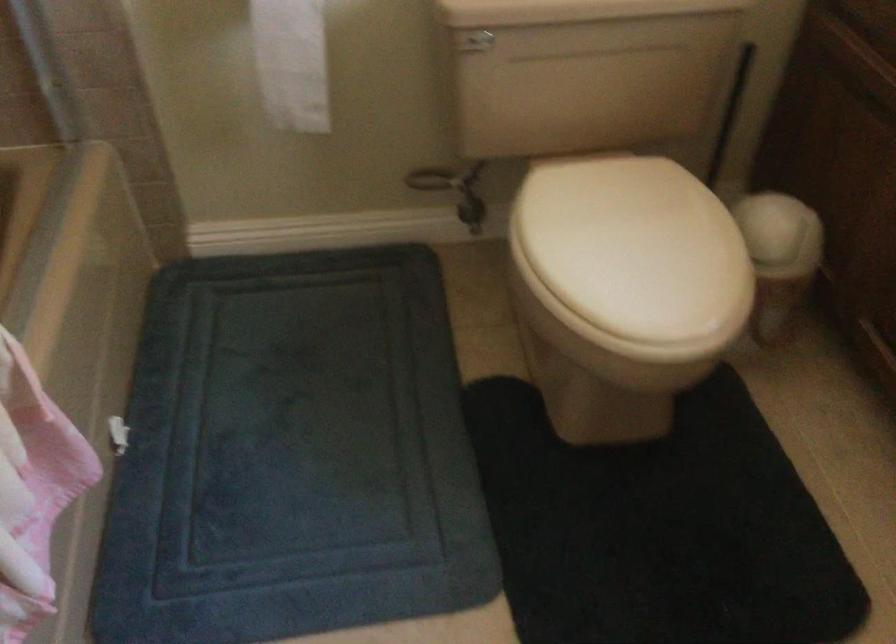
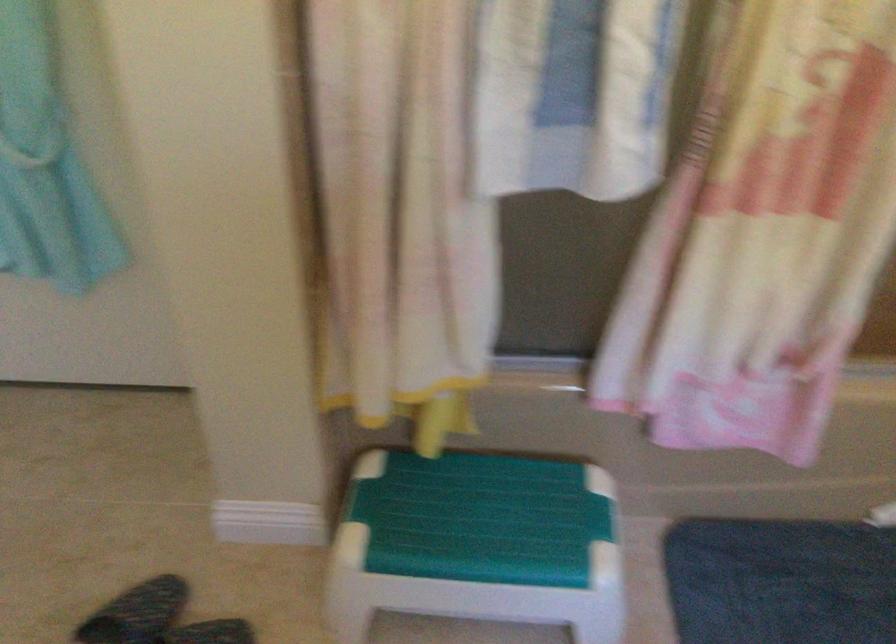
Based on the continuous images, in which direction is the camera rotating?

The camera's rotation is toward left-down.